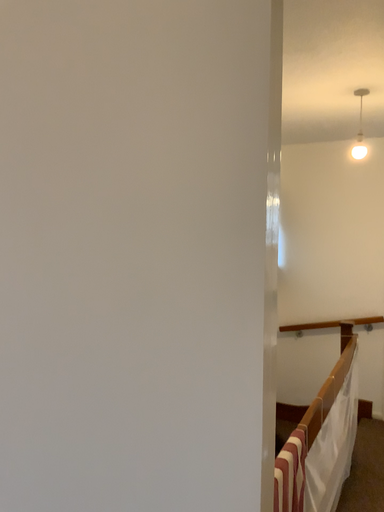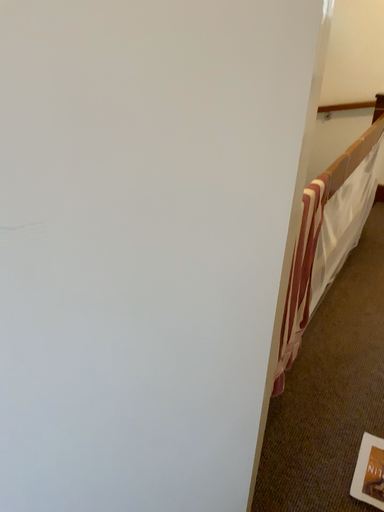
Question: How did the camera likely rotate when shooting the video?

Choices:
 (A) rotated downward
 (B) rotated upward

Answer: (A)